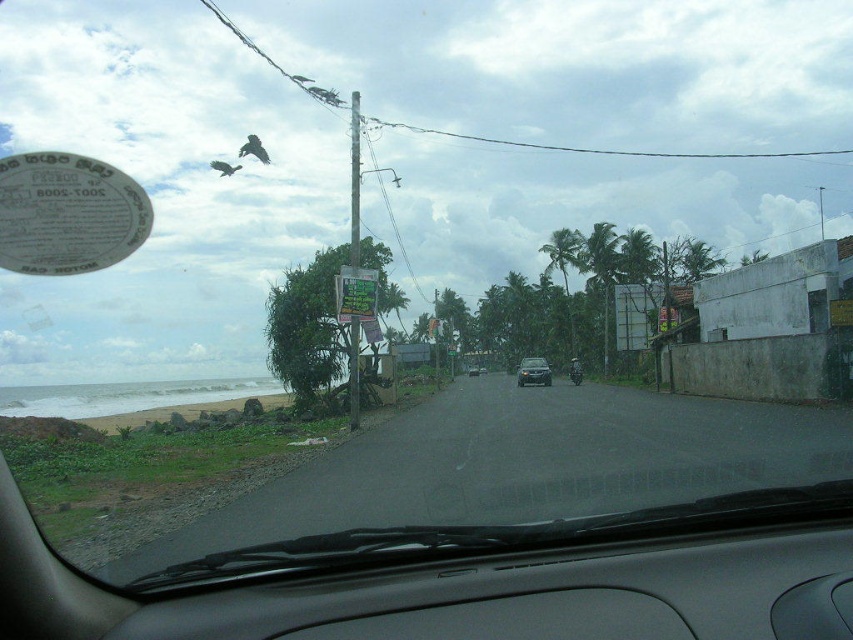
Between black matte dashboard at center and satin silver sedan at center, which one is positioned higher?

black matte dashboard at center is above.

Between black matte dashboard at center and satin silver sedan at center, which one is positioned lower?

satin silver sedan at center

Which is behind, point (706, 605) or point (543, 385)?

Point (543, 385)

Find the location of a particular element. The width and height of the screenshot is (853, 640). black matte dashboard at center is located at coordinates (549, 595).